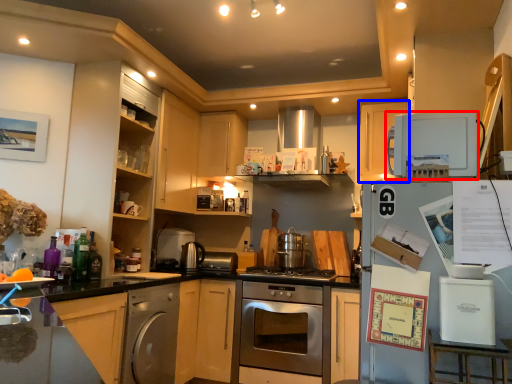
Question: Which point is further to the camera, home appliance (highlighted by a red box) or cabinetry (highlighted by a blue box)?

Choices:
 (A) home appliance
 (B) cabinetry

Answer: (B)